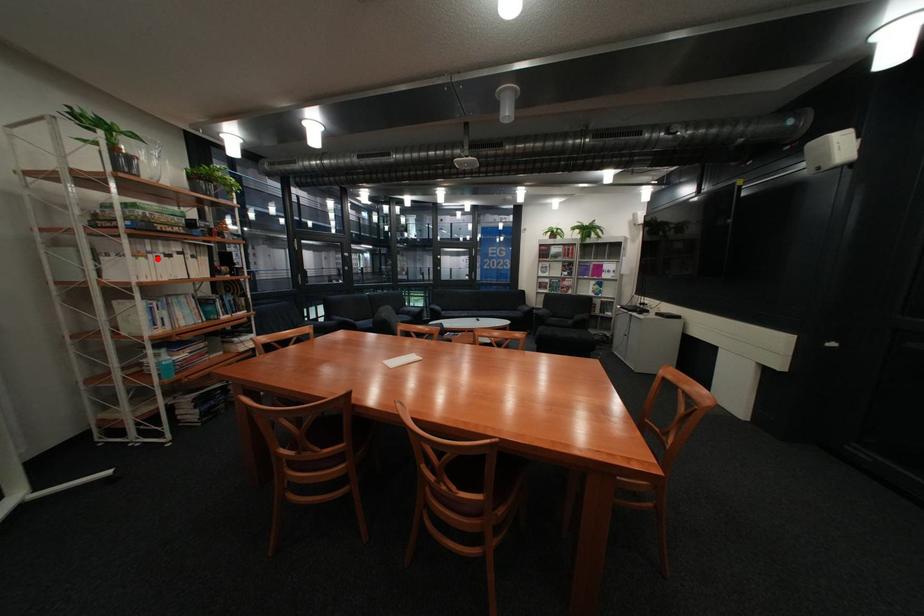
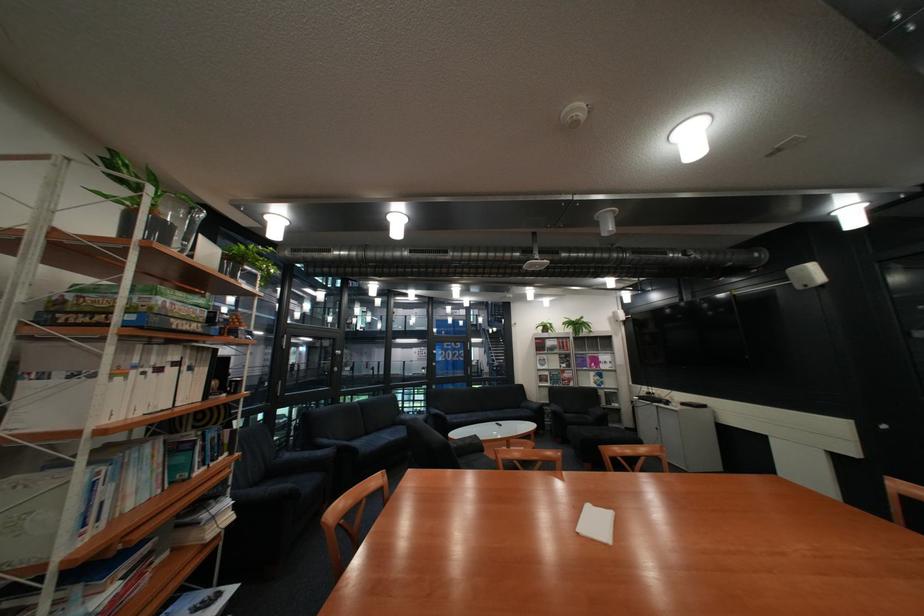
In the second image, find the point that corresponds to the highlighted location in the first image.

(134, 379)